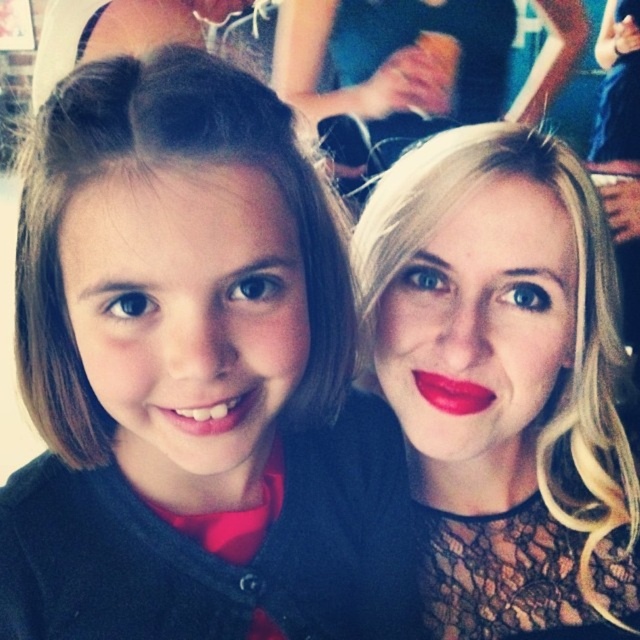
You are a photographer trying to adjust the lighting for a portrait. You notice the brown hair at left and the matte red lipstick at center in your frame. Which object should you focus the light on to ensure it highlights the taller feature?

The brown hair at left is much taller than the matte red lipstick at center, so you should focus the light on the brown hair at left to highlight its height.

You are taking a photo of two people and notice the brown hair at left and the matte red lipstick at center. Which object is positioned lower in the image?

The brown hair at left is located below matte red lipstick at center, so the brown hair at left is positioned lower in the image.